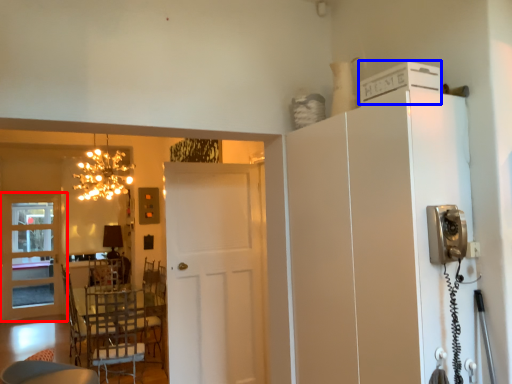
Question: Which object is closer to the camera taking this photo, door (highlighted by a red box) or appliance (highlighted by a blue box)?

Choices:
 (A) door
 (B) appliance

Answer: (B)